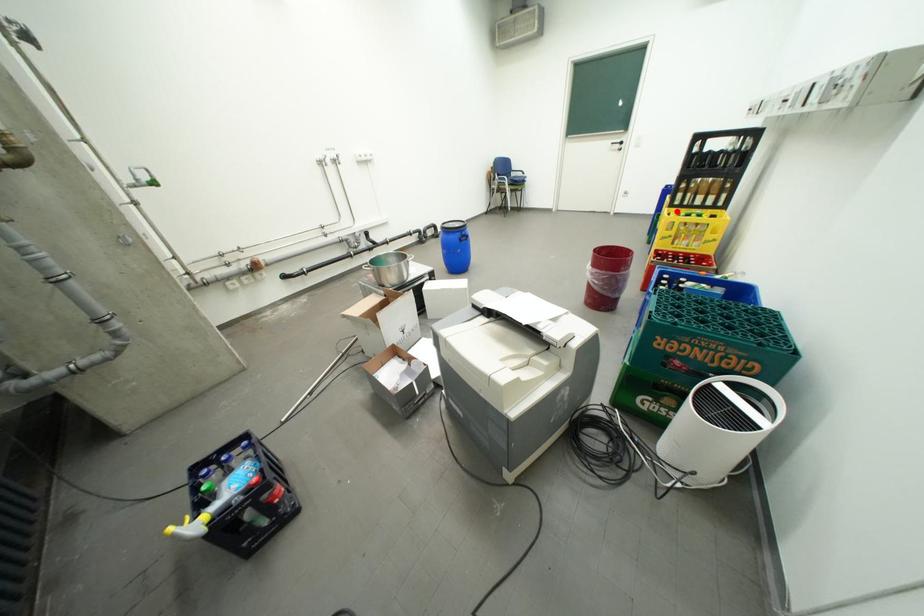
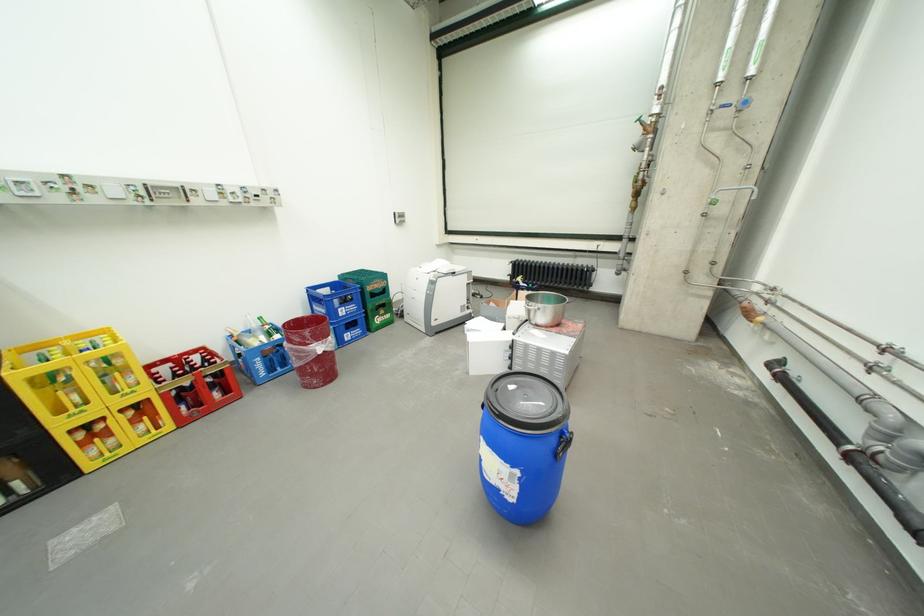
Question: I am providing you with two images of the same scene from different viewpoints. Image1 has a red point marked. In image2, the corresponding 3D location appears at what relative position? Reply with the corresponding letter.

Choices:
 (A) Closer
 (B) Farther

Answer: (B)